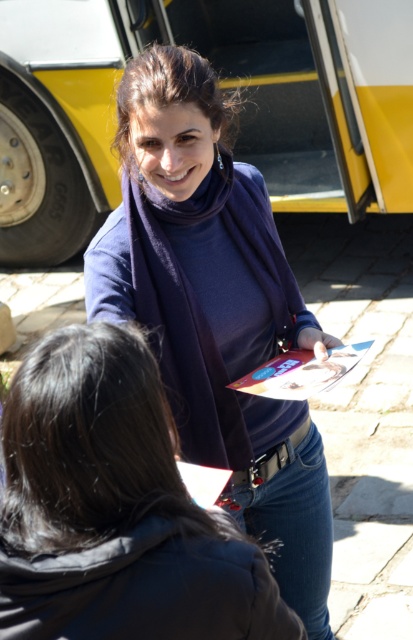
You are a fashion designer observing the scene and want to create a matching accessory set. Which accessory is positioned closer to the front of the person, the blue matte scarf at upper center or the metallic silver belt at center?

The blue matte scarf at upper center is closer to the viewer than the metallic silver belt at center, so it is positioned in front.

You are a fashion designer observing the scene. You notice the matte purple scarf at center and the metallic silver belt at center. Which accessory is positioned higher on the person?

The matte purple scarf at center is positioned higher than the metallic silver belt at center.